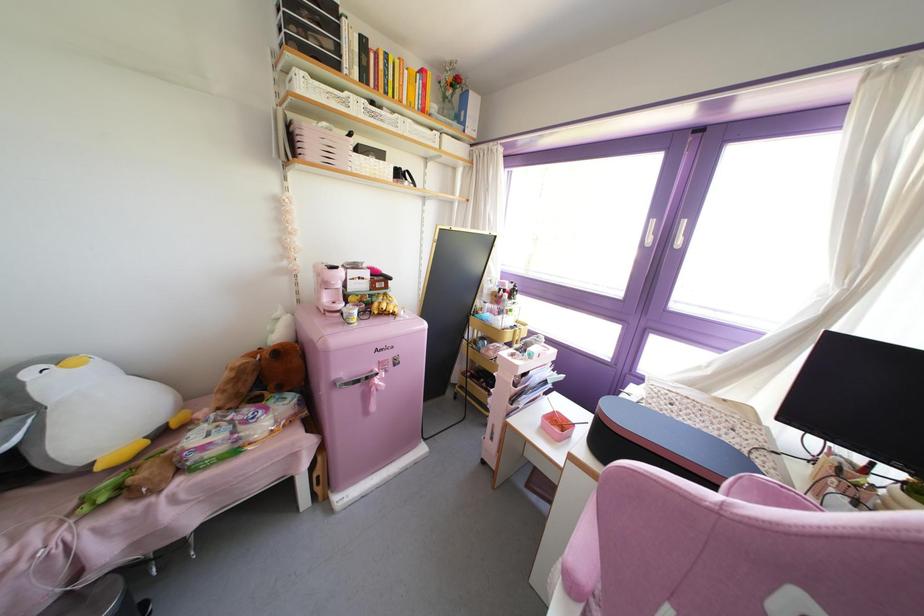
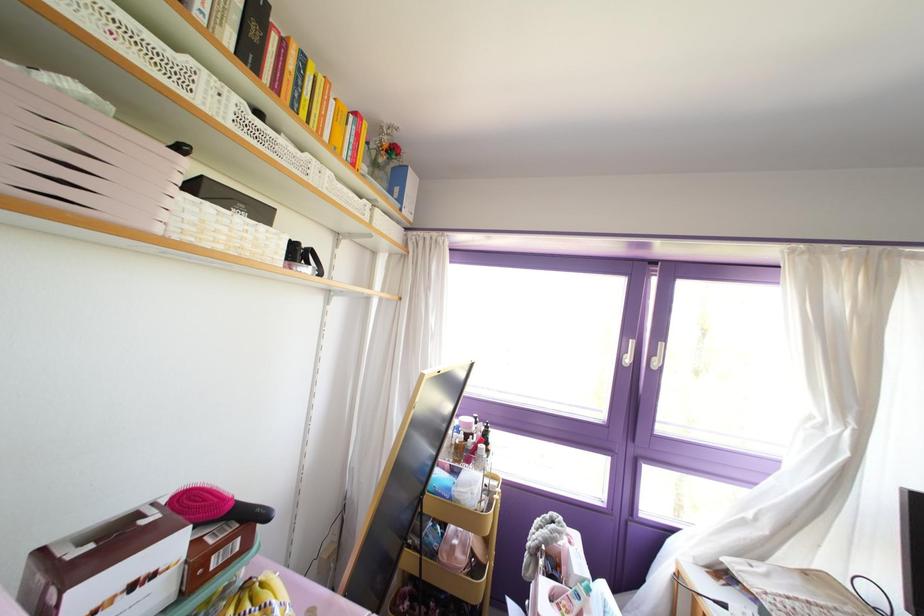
Where in the second image is the point corresponding to [371,160] from the first image?

(237, 219)